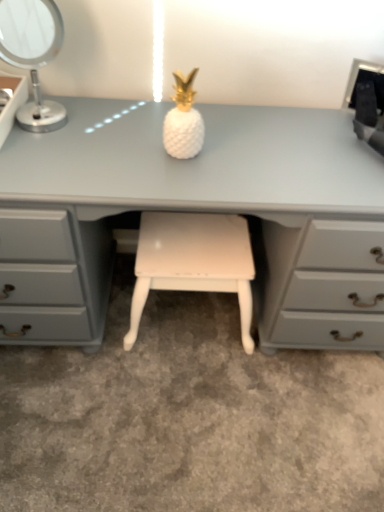
Question: Considering the relative positions of silver metallic table lamp at upper left and matte white desk at center in the image provided, is silver metallic table lamp at upper left to the left of matte white desk at center from the viewer's perspective?

Choices:
 (A) no
 (B) yes

Answer: (B)

Question: From a real-world perspective, is silver metallic table lamp at upper left positioned under matte white desk at center based on gravity?

Choices:
 (A) yes
 (B) no

Answer: (B)

Question: Is silver metallic table lamp at upper left taller than matte white desk at center?

Choices:
 (A) yes
 (B) no

Answer: (B)

Question: Can you confirm if silver metallic table lamp at upper left is shorter than matte white desk at center?

Choices:
 (A) yes
 (B) no

Answer: (A)

Question: Is silver metallic table lamp at upper left at the right side of matte white desk at center?

Choices:
 (A) yes
 (B) no

Answer: (B)

Question: Is silver metallic table lamp at upper left bigger than matte white desk at center?

Choices:
 (A) no
 (B) yes

Answer: (A)

Question: Considering the relative sizes of white glossy pineapple at center and black plastic desktop computer at upper right in the image provided, is white glossy pineapple at center thinner than black plastic desktop computer at upper right?

Choices:
 (A) yes
 (B) no

Answer: (A)

Question: From a real-world perspective, is white glossy pineapple at center under black plastic desktop computer at upper right?

Choices:
 (A) no
 (B) yes

Answer: (A)

Question: Is white glossy pineapple at center at the right side of black plastic desktop computer at upper right?

Choices:
 (A) yes
 (B) no

Answer: (B)

Question: Is black plastic desktop computer at upper right a part of white glossy pineapple at center?

Choices:
 (A) no
 (B) yes

Answer: (A)

Question: Is white glossy pineapple at center smaller than black plastic desktop computer at upper right?

Choices:
 (A) yes
 (B) no

Answer: (A)

Question: From a real-world perspective, is white glossy pineapple at center positioned over black plastic desktop computer at upper right based on gravity?

Choices:
 (A) no
 (B) yes

Answer: (B)

Question: Can you confirm if silver metallic table lamp at upper left is bigger than white painted wood stool at center?

Choices:
 (A) yes
 (B) no

Answer: (B)